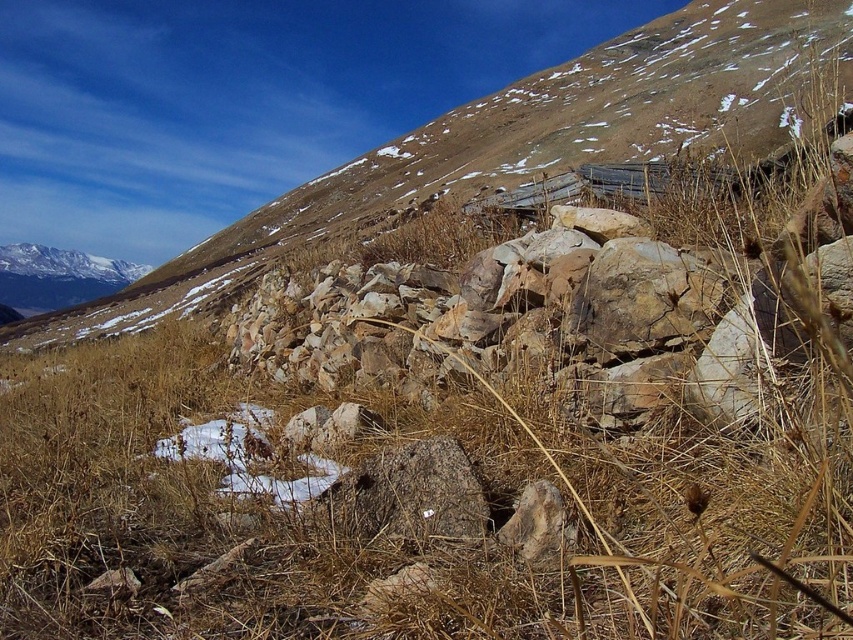
Question: Does dry grass at center come behind rocky at center?

Choices:
 (A) no
 (B) yes

Answer: (A)

Question: Which object appears farthest from the camera in this image?

Choices:
 (A) rocky at center
 (B) dry grass at center

Answer: (A)

Question: Does dry grass at center come behind rocky at center?

Choices:
 (A) no
 (B) yes

Answer: (A)

Question: Which point is closer to the camera?

Choices:
 (A) dry grass at center
 (B) rocky at center

Answer: (A)

Question: Is dry grass at center to the right of rocky at center from the viewer's perspective?

Choices:
 (A) yes
 (B) no

Answer: (B)